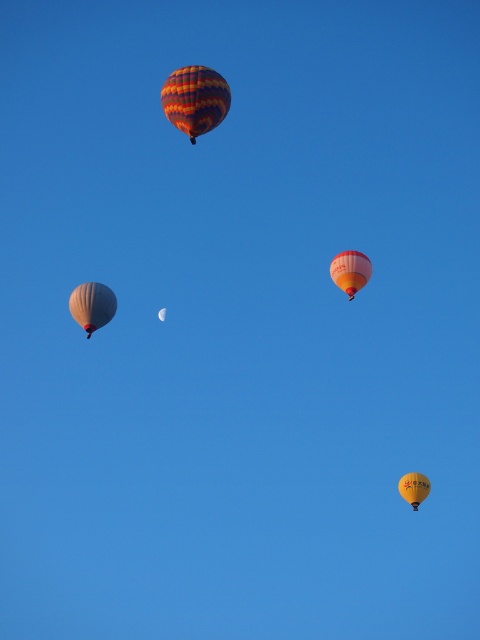
You are standing on the ground observing the yellow fabric balloon at lower right and the matte white hot air balloon at upper left. Which balloon appears nearer to you?

The yellow fabric balloon at lower right appears nearer to you because it is closer to the viewer than the matte white hot air balloon at upper left.

You are an observer looking at the sky scene. You see the striped fabric hot air balloon at upper center and the matte white balloon at left. Which balloon is positioned to the right side of the other?

The striped fabric hot air balloon at upper center is positioned to the right of the matte white balloon at left.

You are an observer looking at the sky scene with two hot air balloons. The striped fabric hot air balloon at upper center and the yellow fabric balloon at lower right are both visible. Which balloon is positioned more to the east if the image is oriented with north at the top?

The striped fabric hot air balloon at upper center is to the left of the yellow fabric balloon at lower right. Since the image is oriented with north at the top, left corresponds to west and right to east. Therefore, the yellow fabric balloon at lower right is positioned more to the east.